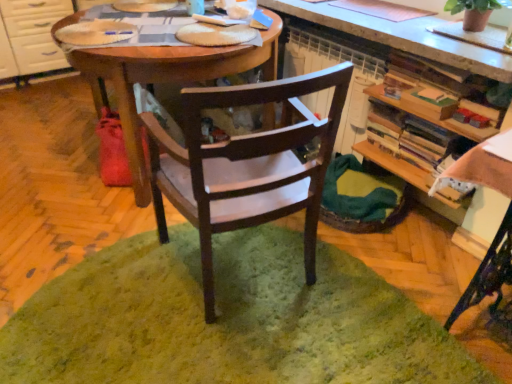
Locate an element on the screen. The image size is (512, 384). blank area beneath green fuzzy rug at center (from a real-world perspective) is located at coordinates (209, 330).